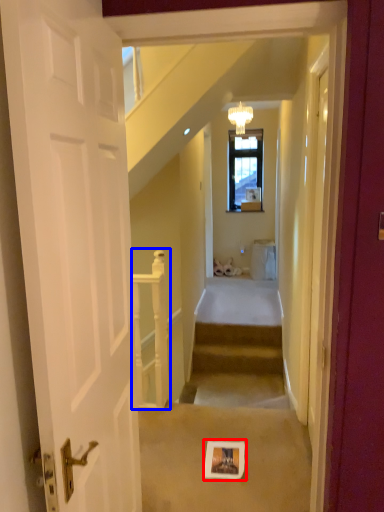
Question: Which object is further to the camera taking this photo, picture frame (highlighted by a red box) or rail (highlighted by a blue box)?

Choices:
 (A) picture frame
 (B) rail

Answer: (B)